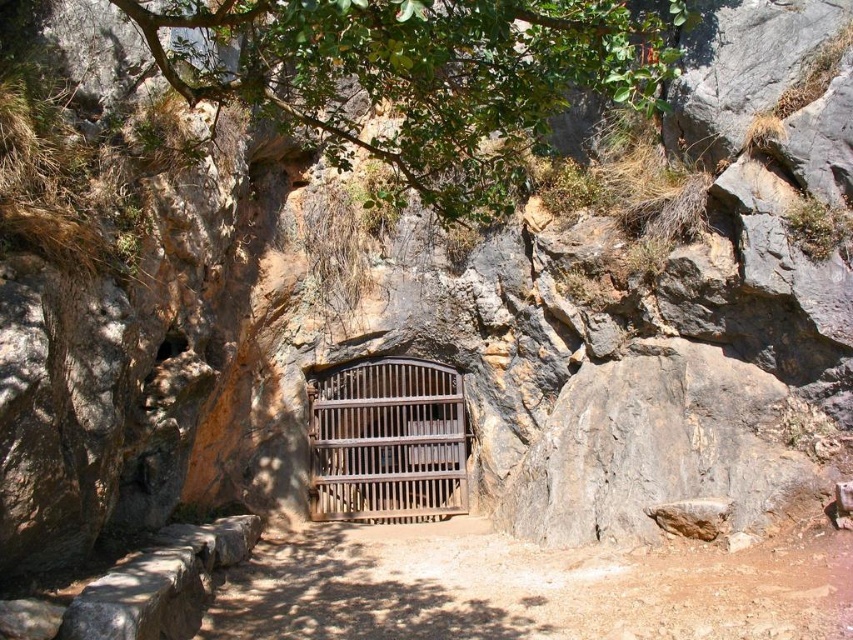
Question: Which object is closer to the camera taking this photo?

Choices:
 (A) brown wooden gate at center
 (B) green leafy tree at upper center

Answer: (B)

Question: Among these points, which one is nearest to the camera?

Choices:
 (A) (378, 472)
 (B) (376, 44)

Answer: (B)

Question: Is green leafy tree at upper center to the right of brown wooden gate at center from the viewer's perspective?

Choices:
 (A) yes
 (B) no

Answer: (A)

Question: Can you confirm if green leafy tree at upper center is positioned below brown wooden gate at center?

Choices:
 (A) yes
 (B) no

Answer: (B)

Question: Does green leafy tree at upper center have a smaller size compared to brown wooden gate at center?

Choices:
 (A) yes
 (B) no

Answer: (A)

Question: Among these objects, which one is farthest from the camera?

Choices:
 (A) green leafy tree at upper center
 (B) brown wooden gate at center

Answer: (B)